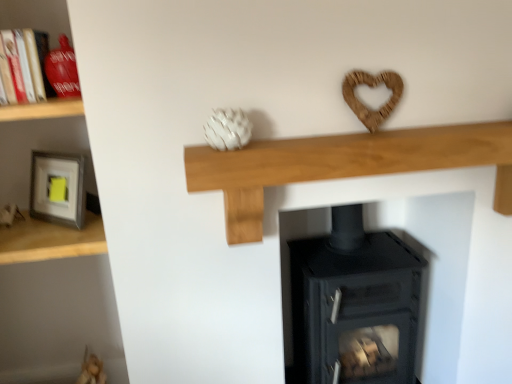
Question: Is matte gray frame at left, which ranks as the second shelf in left-to-right order, shorter than matte gray frame at left, arranged as the fourth shelf when viewed from the right?

Choices:
 (A) no
 (B) yes

Answer: (B)

Question: Is matte gray frame at left, arranged as the third shelf when viewed from the right, behind matte gray frame at left, which appears as the first shelf when viewed from the left?

Choices:
 (A) yes
 (B) no

Answer: (A)

Question: From the image's perspective, is matte gray frame at left, which ranks as the second shelf in left-to-right order, on matte gray frame at left, which appears as the first shelf when viewed from the left?

Choices:
 (A) yes
 (B) no

Answer: (B)

Question: Is matte gray frame at left, arranged as the third shelf when viewed from the right, not within matte gray frame at left, arranged as the fourth shelf when viewed from the right?

Choices:
 (A) yes
 (B) no

Answer: (B)

Question: Does matte gray frame at left, which ranks as the second shelf in left-to-right order, have a greater width compared to matte gray frame at left, arranged as the fourth shelf when viewed from the right?

Choices:
 (A) yes
 (B) no

Answer: (A)

Question: Is point (78, 243) positioned closer to the camera than point (30, 112)?

Choices:
 (A) farther
 (B) closer

Answer: (A)

Question: Is matte gray frame at left, which ranks as the second shelf in left-to-right order, bigger or smaller than wooden shelf at left, which appears as the 2th shelf when viewed from the right?

Choices:
 (A) small
 (B) big

Answer: (B)

Question: Is matte gray frame at left, which ranks as the second shelf in left-to-right order, inside the boundaries of wooden shelf at left, acting as the 3th shelf starting from the left, or outside?

Choices:
 (A) outside
 (B) inside

Answer: (A)

Question: From a real-world perspective, is matte gray frame at left, arranged as the third shelf when viewed from the right, above or below wooden shelf at left, acting as the 3th shelf starting from the left?

Choices:
 (A) above
 (B) below

Answer: (B)

Question: Do you think matte gray frame at left, which ranks as the second shelf in left-to-right order, is within matte red vase at upper left, or outside of it?

Choices:
 (A) inside
 (B) outside

Answer: (B)

Question: Visually, is matte gray frame at left, which ranks as the second shelf in left-to-right order, positioned to the left or to the right of matte red vase at upper left?

Choices:
 (A) right
 (B) left

Answer: (A)

Question: Is matte gray frame at left, arranged as the third shelf when viewed from the right, bigger or smaller than matte red vase at upper left?

Choices:
 (A) small
 (B) big

Answer: (B)

Question: In the image, is matte gray frame at left, arranged as the third shelf when viewed from the right, positioned in front of or behind matte red vase at upper left?

Choices:
 (A) behind
 (B) front

Answer: (A)

Question: Is matte red vase at upper left taller or shorter than black matte wood burning stove at center?

Choices:
 (A) short
 (B) tall

Answer: (A)

Question: Based on their sizes in the image, would you say matte red vase at upper left is bigger or smaller than black matte wood burning stove at center?

Choices:
 (A) small
 (B) big

Answer: (A)